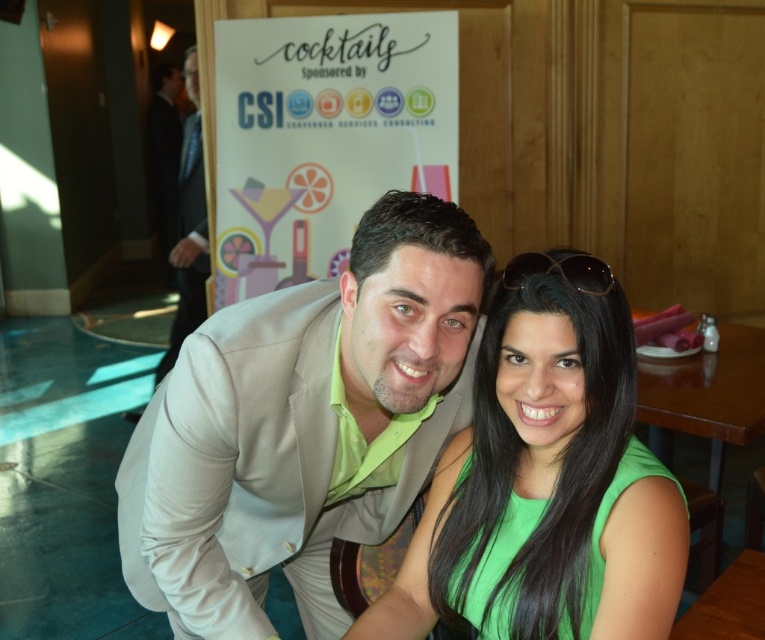
Question: Estimate the real-world distances between objects in this image. Which object is closer to the wooden at center?

Choices:
 (A) sunglasses at upper center
 (B) black suit at left
 (C) green matte dress at center
 (D) light beige suit at center

Answer: (C)

Question: Can you confirm if light beige suit at center is positioned to the right of green matte dress at center?

Choices:
 (A) yes
 (B) no

Answer: (B)

Question: Is light beige suit at center wider than green matte dress at center?

Choices:
 (A) yes
 (B) no

Answer: (A)

Question: Which object appears farthest from the camera in this image?

Choices:
 (A) light beige suit at center
 (B) black suit at left
 (C) wooden at center

Answer: (B)

Question: Considering the real-world distances, which object is farthest from the sunglasses at upper center?

Choices:
 (A) wooden at center
 (B) green matte dress at center
 (C) light beige suit at center
 (D) black suit at left

Answer: (D)

Question: Is green matte dress at center smaller than wooden at center?

Choices:
 (A) yes
 (B) no

Answer: (B)